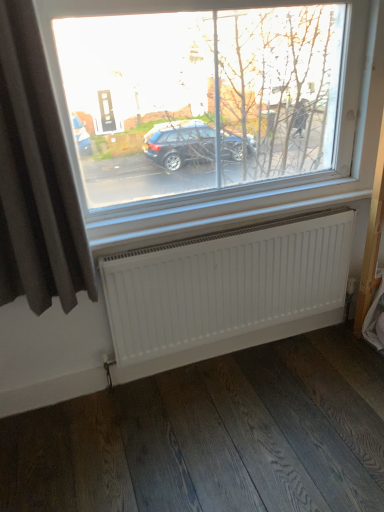
This screenshot has width=384, height=512. In order to click on vacant area on top of white matte radiator at lower center (from a real-world perspective) in this screenshot , I will do `click(218, 231)`.